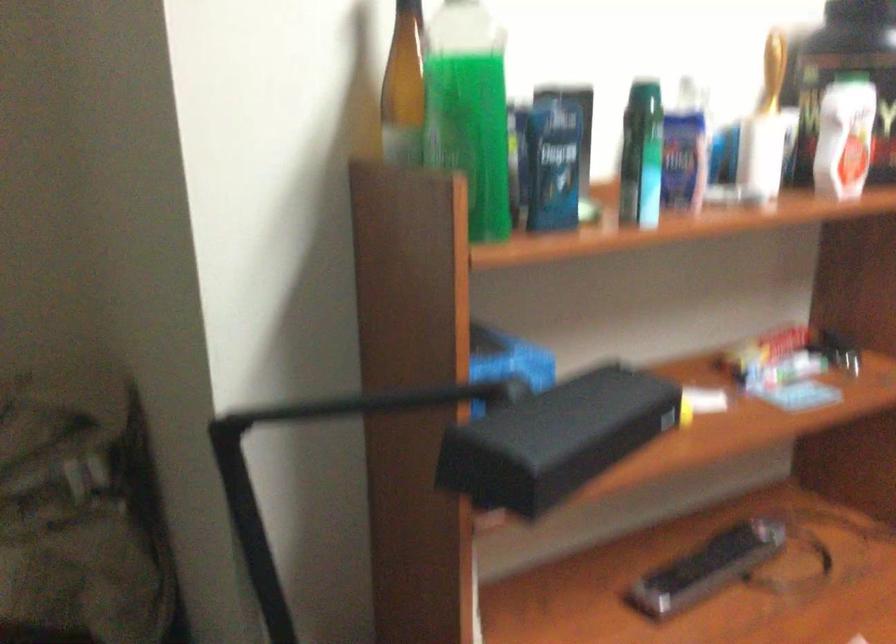
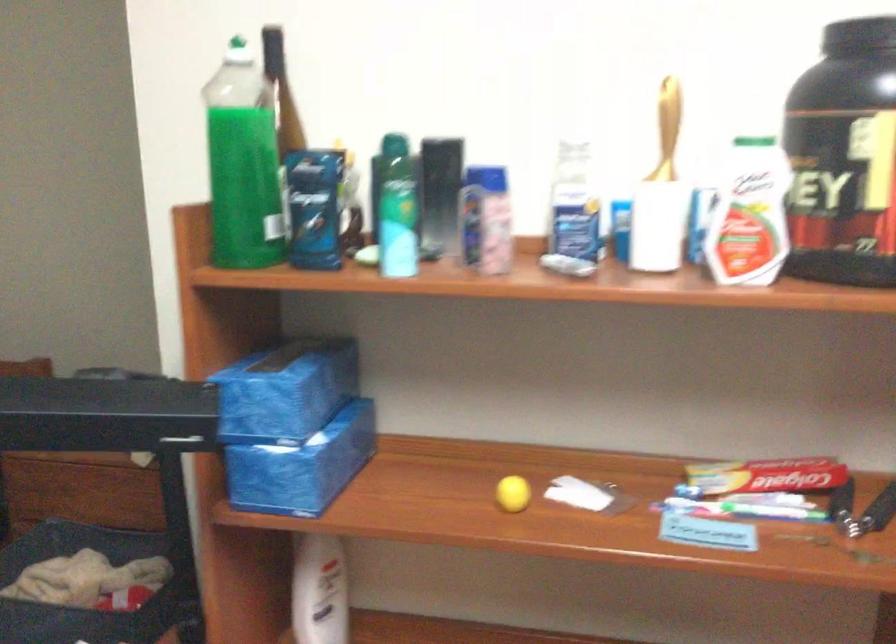
In the second image, find the point that corresponds to [572,136] in the first image.

(438, 194)